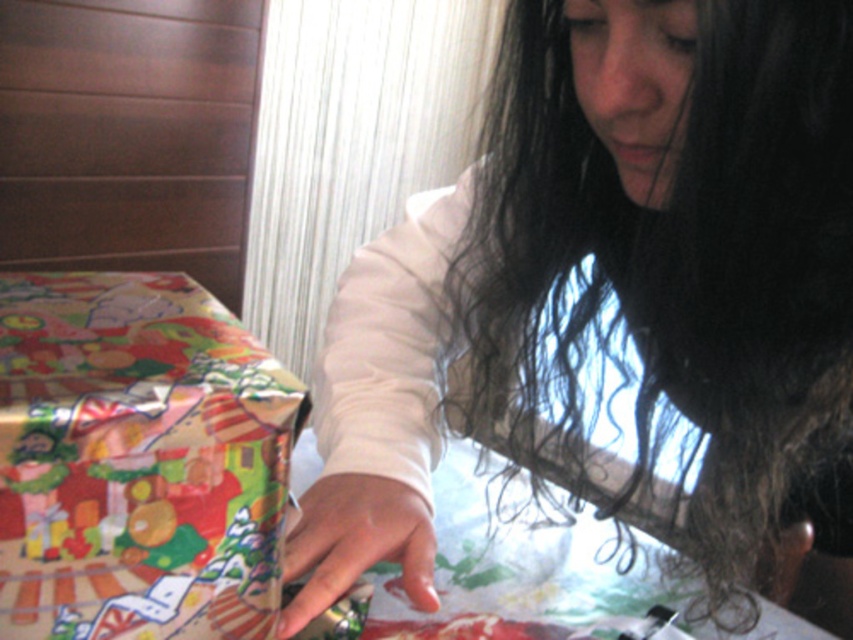
You are a gift wrapper who needs to ensure that the shiny metallic gift at lower left is fully covered by the white matte hand at center during the wrapping process. Based on the scene description, can the hand cover the gift completely?

The white matte hand at center might be wider than shiny metallic gift at lower left, so there is a possibility that the hand can fully cover the gift during wrapping.

You are a gift wrapper who needs to ensure proper placement of the gift. Based on the scene, is the white matte hand at center positioned above or below the shiny metallic gift at lower left?

The white matte hand at center is located below the shiny metallic gift at lower left according to the description.